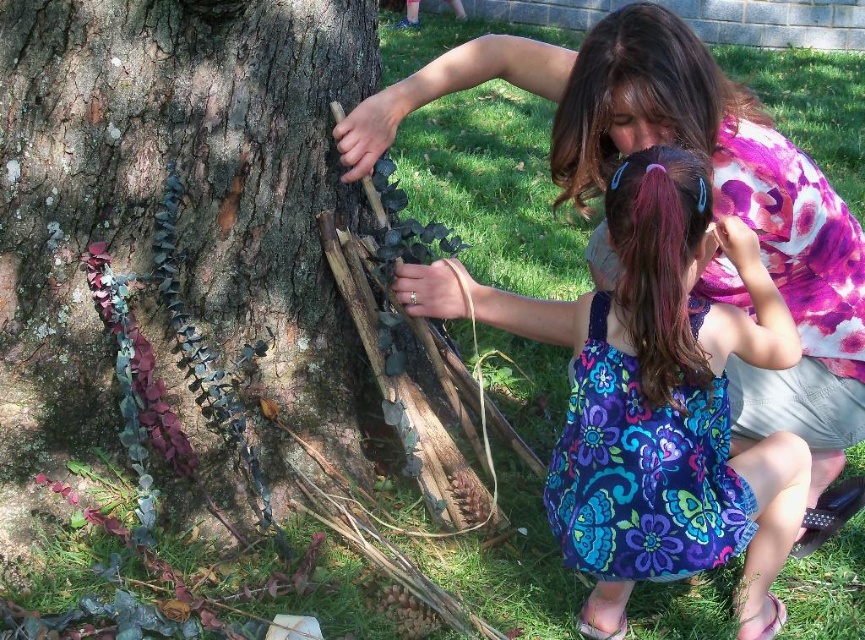
Question: Is the position of green mossy bark at left less distant than that of floral dress at center?

Choices:
 (A) no
 (B) yes

Answer: (A)

Question: Which point is closer to the camera taking this photo?

Choices:
 (A) (252, 20)
 (B) (630, 435)

Answer: (B)

Question: Is green mossy bark at left below floral dress at center?

Choices:
 (A) no
 (B) yes

Answer: (A)

Question: Which of the following is the closest to the observer?

Choices:
 (A) (776, 490)
 (B) (204, 328)

Answer: (A)

Question: Is green mossy bark at left further to the viewer compared to floral dress at center?

Choices:
 (A) no
 (B) yes

Answer: (B)